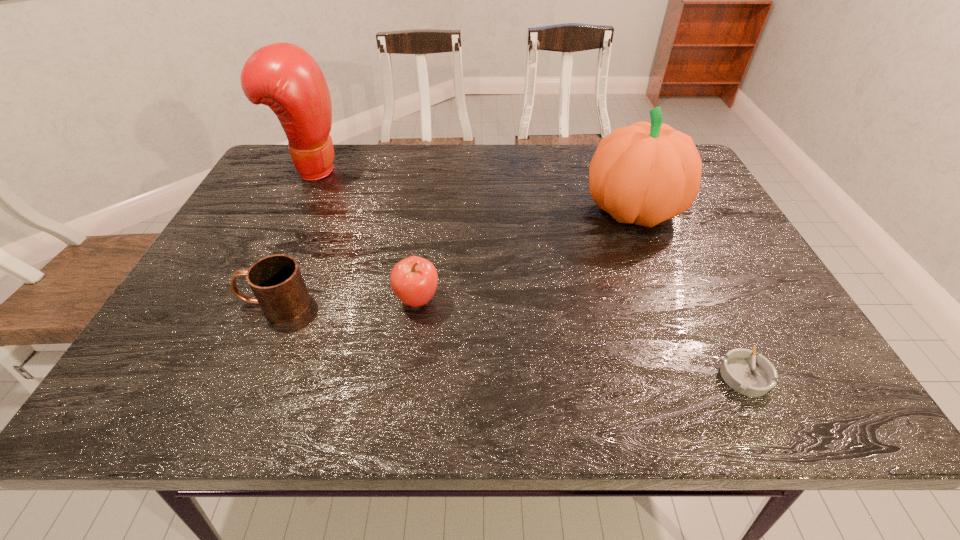
You are a GUI agent. You are given a task and a screenshot of the screen. Output one action in this format:
    pyautogui.click(x=<x>, y=<y>)
    Task: Click on the free space between the boxing glove and the second tallest object
    The width and height of the screenshot is (960, 540).
    Given the screenshot: What is the action you would take?
    pyautogui.click(x=472, y=190)

At what (x,y) coordinates should I click in order to perform the action: click on vacant region between the apple and the nearest object. Please return your answer as a coordinate pair (x, y). The height and width of the screenshot is (540, 960). Looking at the image, I should click on (581, 338).

You are a GUI agent. You are given a task and a screenshot of the screen. Output one action in this format:
    pyautogui.click(x=<x>, y=<y>)
    Task: Click on the blank region between the tallest object and the fourth shortest object
    
    Given the screenshot: What is the action you would take?
    pyautogui.click(x=472, y=190)

Identify the location of vacant area that lies between the mug and the pumpkin. This screenshot has height=540, width=960. (454, 257).

Locate an element on the screen. This screenshot has height=540, width=960. unoccupied area between the tallest object and the pumpkin is located at coordinates (472, 190).

Choose which object is the second nearest neighbor to the third object from right to left. Please provide its 2D coordinates. Your answer should be formatted as a tuple, i.e. [(x, y)], where the tuple contains the x and y coordinates of a point satisfying the conditions above.

[(646, 173)]

I want to click on the closest object relative to the boxing glove, so click(276, 281).

The image size is (960, 540). Find the location of `free location that satisfies the following two spatial constraints: 1. on the back side of the third object from right to left; 2. on the striking surface of the tallest object`. free location that satisfies the following two spatial constraints: 1. on the back side of the third object from right to left; 2. on the striking surface of the tallest object is located at coordinates (435, 169).

Find the location of a particular element. This screenshot has width=960, height=540. free point that satisfies the following two spatial constraints: 1. on the striking surface of the shortest object; 2. on the left side of the boxing glove is located at coordinates (208, 375).

The image size is (960, 540). Identify the location of vacant space that satisfies the following two spatial constraints: 1. on the striking surface of the tallest object; 2. on the left side of the shortest object. (208, 375).